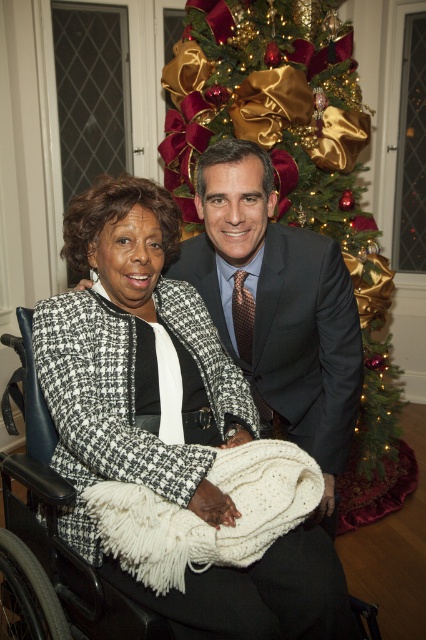
You are a photographer setting up for a holiday photo shoot. You need to ensure that the gold shiny tinsel at upper center and the black plastic wheelchair at lower left are both visible in the frame. Based on their sizes, which object will appear wider in the photo?

The gold shiny tinsel at upper center will appear wider in the photo because its width surpasses that of the black plastic wheelchair at lower left according to the description.

In the scene shown: You are a photographer trying to capture the best angle of the scene. You notice two points marked in the image at coordinates point (386, 390) and point (39, 387). Which point is closer to your camera lens?

Point (386, 390) is further to the viewer than point (39, 387), so the point closer to the camera lens is point (39, 387).

You are a photographer setting up for a holiday photo. You want to capture the gold shiny tinsel at upper center in focus while ensuring the woman in the wheelchair and the man beside her are also in the frame. Given that your camera has a depth of field that can sharply focus on objects within a 2.5 meter range, will the tinsel and the people be in focus together?

The gold shiny tinsel at upper center is 2.32 meters from the camera, which is within the 2.5 meter depth of field range. Since the woman and the man are closer than the tinsel, they would also be within the focus range. Therefore, both the tinsel and the people will be in focus together.